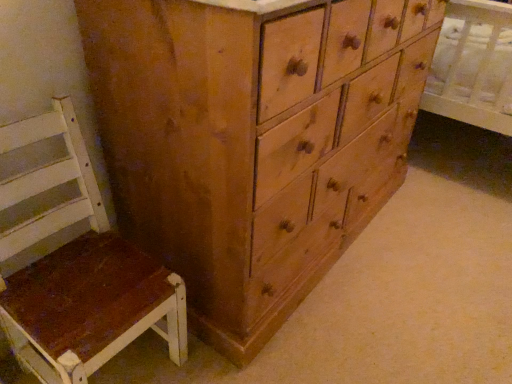
Measure the distance between point (292, 298) and camera.

A distance of 1.26 meters exists between point (292, 298) and camera.

What do you see at coordinates (253, 141) in the screenshot? I see `wooden chest of drawers at center` at bounding box center [253, 141].

What is the approximate height of wooden chest of drawers at center?

wooden chest of drawers at center is 2.82 centimeters tall.

Where is `wooden chest of drawers at center`? The height and width of the screenshot is (384, 512). wooden chest of drawers at center is located at coordinates (253, 141).

Identify the location of white wood chair at left. (78, 269).

This screenshot has height=384, width=512. What do you see at coordinates (78, 269) in the screenshot?
I see `white wood chair at left` at bounding box center [78, 269].

From the picture: In order to face white wood chair at left, should I rotate leftwards or rightwards?

It's best to rotate left around 22.947 degrees.

Where is `wooden chest of drawers at center`? This screenshot has height=384, width=512. wooden chest of drawers at center is located at coordinates 253,141.

Between white wood chair at left and wooden chest of drawers at center, which one appears on the right side from the viewer's perspective?

Positioned to the right is wooden chest of drawers at center.

Which object is further away from the camera taking this photo, white wood chair at left or wooden chest of drawers at center?

wooden chest of drawers at center.

Between point (86, 331) and point (191, 136), which one is positioned behind?

The point (86, 331) is farther from the camera.

From the image's perspective, which one is positioned lower, white wood chair at left or wooden chest of drawers at center?

white wood chair at left is shown below in the image.

From a real-world perspective, which is physically below, white wood chair at left or wooden chest of drawers at center?

wooden chest of drawers at center.

Which object is thinner, white wood chair at left or wooden chest of drawers at center?

white wood chair at left.

In terms of height, does white wood chair at left look taller or shorter compared to wooden chest of drawers at center?

Clearly, white wood chair at left is taller compared to wooden chest of drawers at center.

Which of these two, white wood chair at left or wooden chest of drawers at center, is smaller?

With smaller size is wooden chest of drawers at center.

Is white wood chair at left surrounding wooden chest of drawers at center?

No, wooden chest of drawers at center is not inside white wood chair at left.

Is white wood chair at left beside wooden chest of drawers at center?

white wood chair at left is not next to wooden chest of drawers at center, and they're not touching.

Could you tell me if white wood chair at left is turned towards wooden chest of drawers at center?

No.

Consider the image. Can you tell me how much white wood chair at left and wooden chest of drawers at center differ in facing direction?

There is a 89.3-degree angle between the facing directions of white wood chair at left and wooden chest of drawers at center.

This screenshot has height=384, width=512. I want to click on the chest of drawers located behind the white wood chair at left, so click(253, 141).

Considering the positions of objects wooden chest of drawers at center and white wood chair at left in the image provided, who is more to the right, wooden chest of drawers at center or white wood chair at left?

wooden chest of drawers at center is more to the right.

Relative to white wood chair at left, is wooden chest of drawers at center in front or behind?

Clearly, wooden chest of drawers at center is behind white wood chair at left.

Does point (191, 157) appear closer or farther from the camera than point (128, 301)?

Point (191, 157) is closer to the camera than point (128, 301).

From the image's perspective, which is below, wooden chest of drawers at center or white wood chair at left?

From the image's view, white wood chair at left is below.

From a real-world perspective, is wooden chest of drawers at center over white wood chair at left?

No, from a real-world perspective, wooden chest of drawers at center is not above white wood chair at left.

Can you confirm if wooden chest of drawers at center is wider than white wood chair at left?

Correct, the width of wooden chest of drawers at center exceeds that of white wood chair at left.

Which of these two, wooden chest of drawers at center or white wood chair at left, stands shorter?

wooden chest of drawers at center is shorter.

Can you confirm if wooden chest of drawers at center is smaller than white wood chair at left?

Yes, wooden chest of drawers at center is smaller than white wood chair at left.

Can white wood chair at left be found inside wooden chest of drawers at center?

No, wooden chest of drawers at center does not contain white wood chair at left.

Are wooden chest of drawers at center and white wood chair at left located far from each other?

That's not correct — wooden chest of drawers at center is a little close to white wood chair at left.

Is wooden chest of drawers at center positioned with its back to white wood chair at left?

wooden chest of drawers at center does not have its back to white wood chair at left.

What's the angular difference between wooden chest of drawers at center and white wood chair at left's facing directions?

89.3 degrees.

You are a GUI agent. You are given a task and a screenshot of the screen. Output one action in this format:
    pyautogui.click(x=<x>, y=<y>)
    Task: Click on the furniture lying below the wooden chest of drawers at center (from the image's perspective)
    
    Given the screenshot: What is the action you would take?
    pyautogui.click(x=78, y=269)

This screenshot has width=512, height=384. Find the location of `the chest of drawers that appears below the white wood chair at left (from a real-world perspective)`. the chest of drawers that appears below the white wood chair at left (from a real-world perspective) is located at coordinates (253, 141).

Locate an element on the screen. The image size is (512, 384). furniture located on the left of wooden chest of drawers at center is located at coordinates (78, 269).